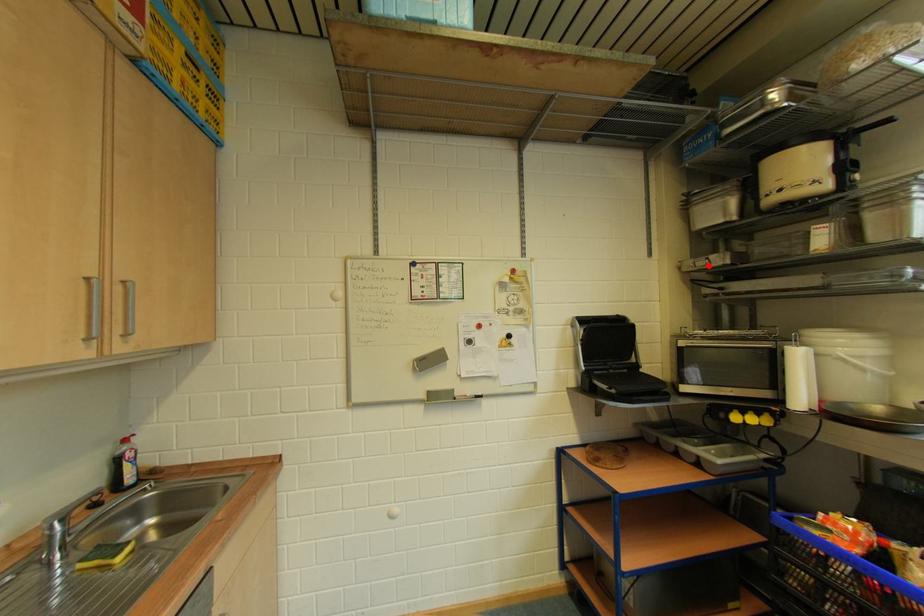
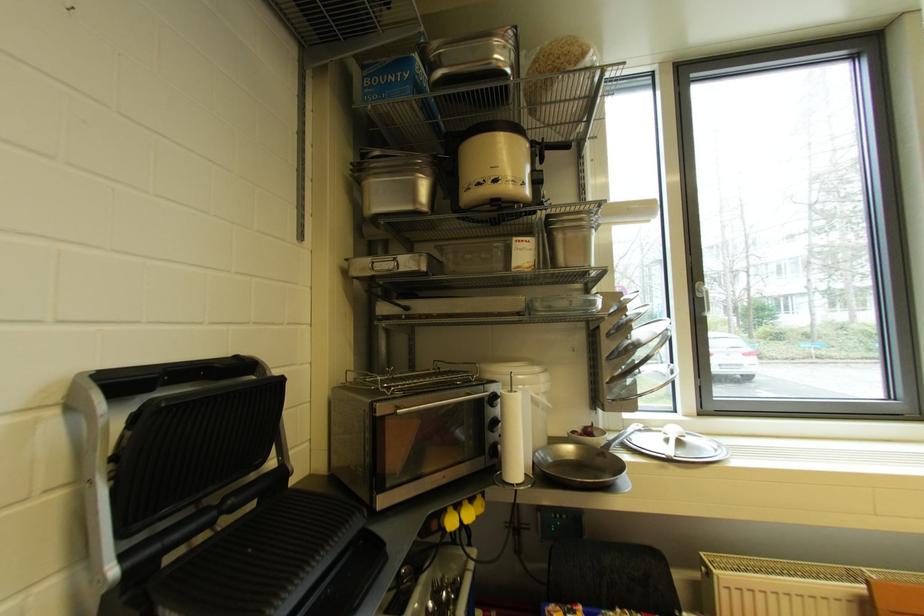
Find the pixel in the second image that matches the highlighted location in the first image.

(392, 269)